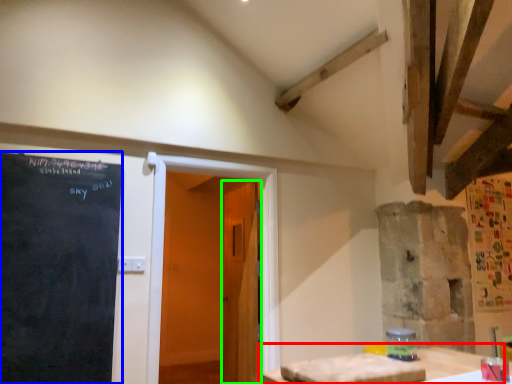
Question: Based on their relative distances, which object is nearer to table (highlighted by a red box)? Choose from blackboard (highlighted by a blue box) and door (highlighted by a green box).

Choices:
 (A) blackboard
 (B) door

Answer: (B)